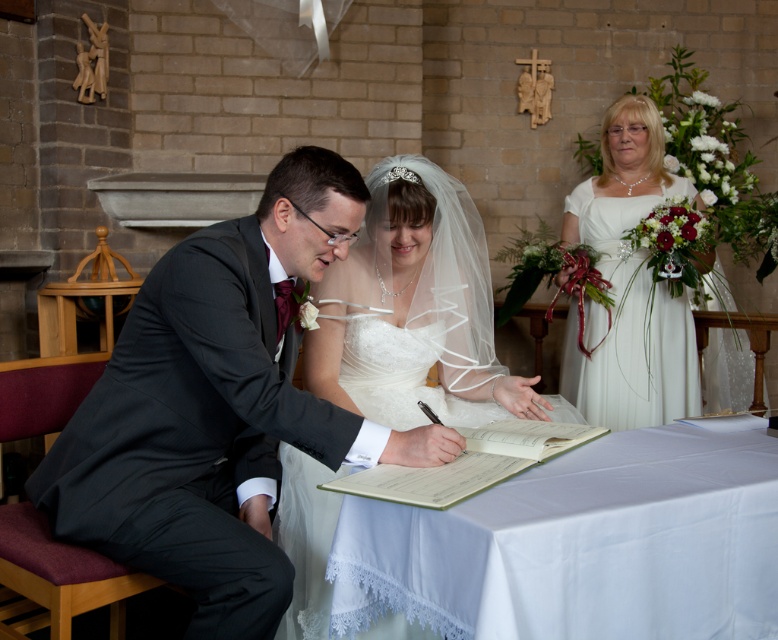
This screenshot has height=640, width=778. Describe the element at coordinates (216, 406) in the screenshot. I see `dark gray suit at center` at that location.

Between point (198, 612) and point (619, 184), which one is positioned behind?

The point (619, 184) is behind.

Which is in front, point (263, 531) or point (612, 259)?

Point (263, 531) is more forward.

Locate an element on the screen. The width and height of the screenshot is (778, 640). dark gray suit at center is located at coordinates (216, 406).

Which of these two, dark gray suit at center or white satin dress at center, stands taller?

white satin dress at center

Is dark gray suit at center bigger than white satin dress at center?

Actually, dark gray suit at center might be smaller than white satin dress at center.

Is point (191, 481) positioned after point (370, 340)?

No, (191, 481) is in front of (370, 340).

This screenshot has height=640, width=778. Identify the location of dark gray suit at center. tap(216, 406).

Is point (230, 250) in front of point (736, 442)?

Yes.

Between point (181, 308) and point (594, 493), which one is positioned in front?

Point (594, 493) is in front.

Who is more forward, (218, 442) or (538, 602)?

Positioned in front is point (538, 602).

Identify the location of dark gray suit at center. (216, 406).